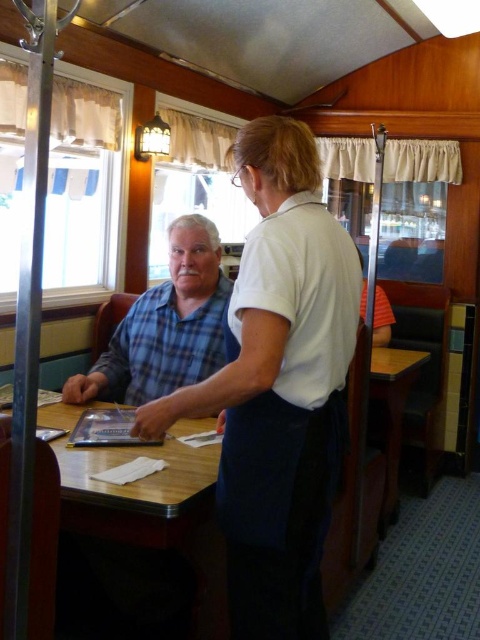
Question: Estimate the real-world distances between objects in this image. Which object is farther from the wooden table at center?

Choices:
 (A) white cotton shirt at center
 (B) wooden table at lower right

Answer: (B)

Question: Is blue plaid shirt at left closer to the viewer compared to wooden table at lower right?

Choices:
 (A) no
 (B) yes

Answer: (B)

Question: Which point is closer to the camera?

Choices:
 (A) (183, 483)
 (B) (263, 512)
 (C) (196, 269)

Answer: (B)

Question: Can you confirm if white cotton shirt at center is thinner than wooden table at center?

Choices:
 (A) yes
 (B) no

Answer: (A)

Question: Where is blue plaid shirt at left located in relation to wooden table at lower right in the image?

Choices:
 (A) below
 (B) above

Answer: (B)

Question: Considering the real-world distances, which object is farthest from the wooden table at center?

Choices:
 (A) white cotton shirt at center
 (B) blue plaid shirt at left
 (C) wooden table at lower right

Answer: (C)